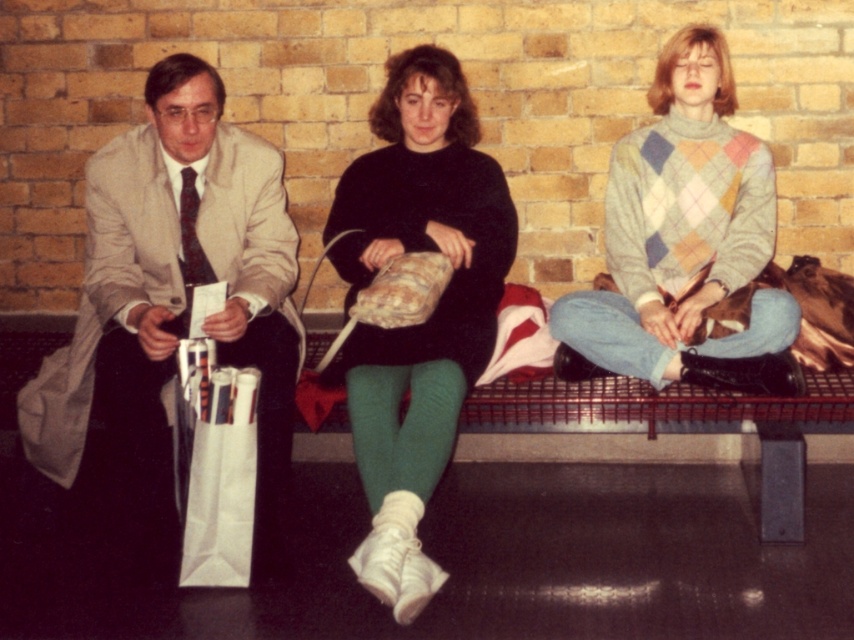
What do you see at coordinates (431, 310) in the screenshot? Image resolution: width=854 pixels, height=640 pixels. I see `black matte sweater at center` at bounding box center [431, 310].

Based on the photo, can you confirm if black matte sweater at center is wider than argyle sweater at center?

No, black matte sweater at center is not wider than argyle sweater at center.

At what (x,y) coordinates should I click in order to perform the action: click on black matte sweater at center. Please return your answer as a coordinate pair (x, y). Looking at the image, I should click on (431, 310).

I want to click on black matte sweater at center, so click(x=431, y=310).

Which of these two, argyle sweater at center or white paper bag at lower left, stands taller?

With more height is argyle sweater at center.

Locate an element on the screen. argyle sweater at center is located at coordinates (674, 220).

Which is behind, point (753, 186) or point (219, 429)?

The point (753, 186) is more distant.

In order to click on argyle sweater at center in this screenshot , I will do `click(674, 220)`.

Who is shorter, matte beige suit at left or white paper bag at lower left?

white paper bag at lower left

Between point (232, 285) and point (220, 536), which one is positioned behind?

The point (232, 285) is behind.

This screenshot has width=854, height=640. I want to click on matte beige suit at left, so click(x=168, y=320).